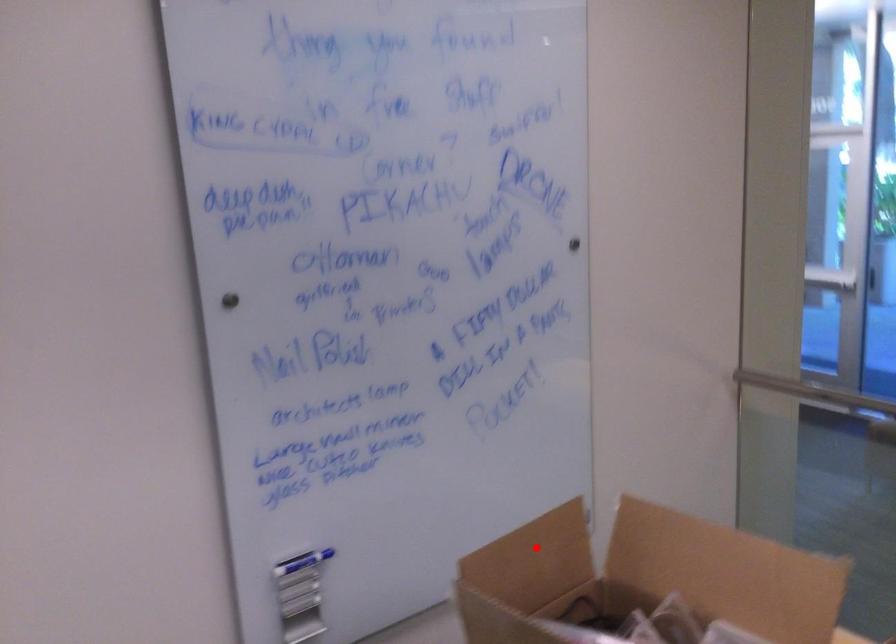
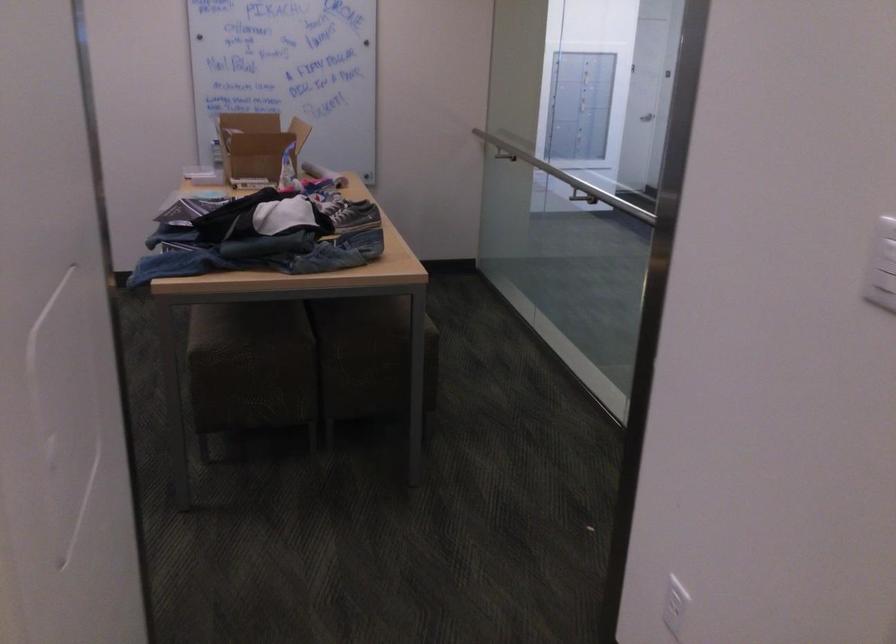
Question: I am providing you with two images of the same scene from different viewpoints. A red point is marked on the first image. At the location where the point appears in image 1, is it still visible in image 2?

Choices:
 (A) Yes
 (B) No

Answer: (B)